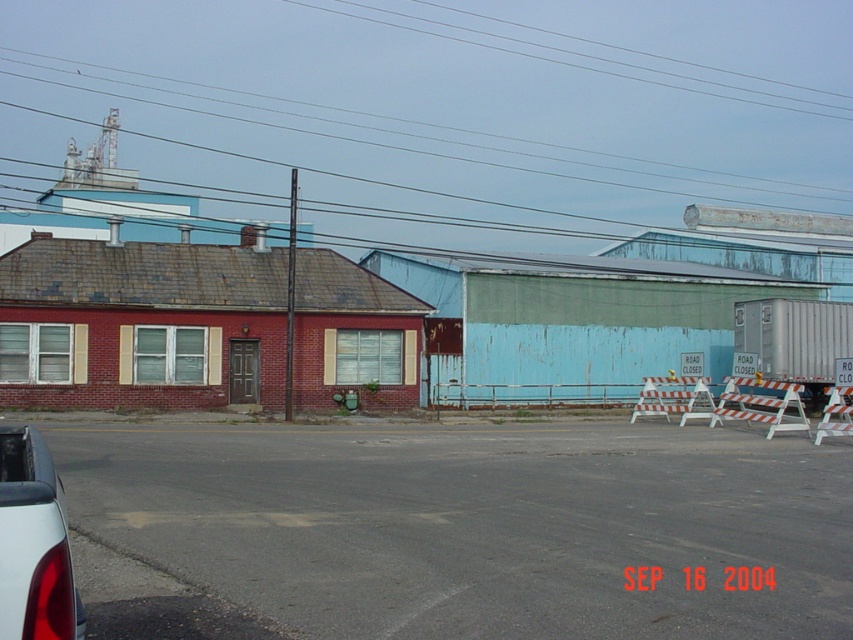
Question: Is matte black car at lower left positioned in front of clear wire at upper center?

Choices:
 (A) yes
 (B) no

Answer: (A)

Question: Does matte black car at lower left appear on the left side of clear wire at upper center?

Choices:
 (A) no
 (B) yes

Answer: (B)

Question: Which point is closer to the camera?

Choices:
 (A) (457, 28)
 (B) (28, 492)

Answer: (B)

Question: Can you confirm if matte black car at lower left is bigger than clear wire at upper center?

Choices:
 (A) no
 (B) yes

Answer: (A)